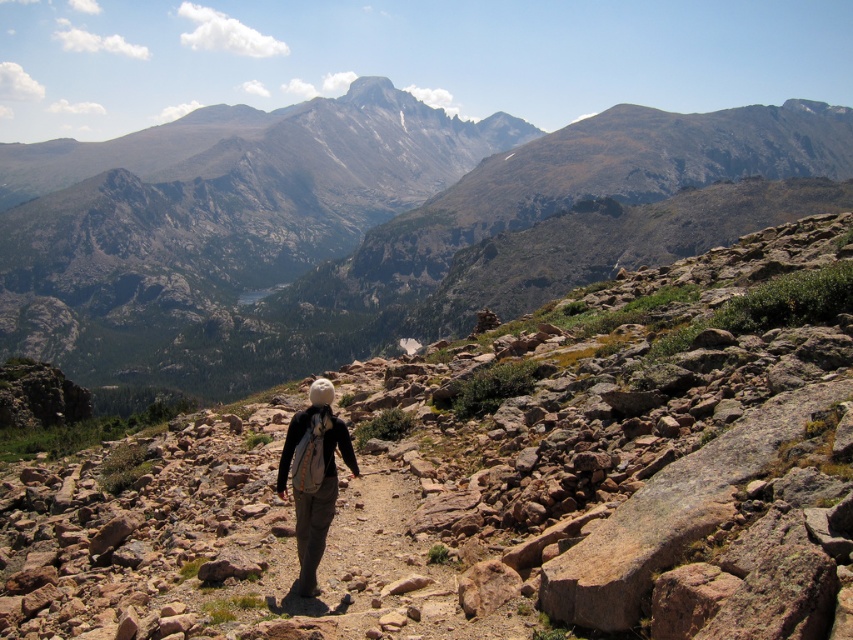
Question: Is rugged granite mountain at center bigger than light brown fabric backpack at center?

Choices:
 (A) no
 (B) yes

Answer: (B)

Question: Which point is closer to the camera?

Choices:
 (A) (96, 339)
 (B) (329, 452)

Answer: (B)

Question: Which point appears farthest from the camera in this image?

Choices:
 (A) (410, 115)
 (B) (285, 444)

Answer: (A)

Question: Which point is closer to the camera taking this photo?

Choices:
 (A) (253, 196)
 (B) (311, 502)

Answer: (B)

Question: Is rugged granite mountain at center bigger than light brown fabric backpack at center?

Choices:
 (A) yes
 (B) no

Answer: (A)

Question: Is rugged granite mountain at center to the left of light brown fabric backpack at center from the viewer's perspective?

Choices:
 (A) yes
 (B) no

Answer: (A)